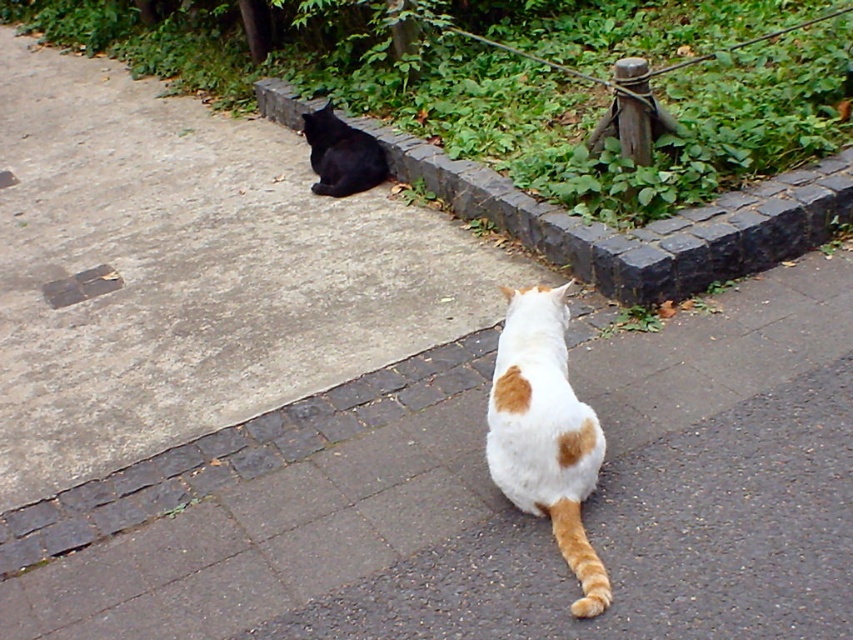
Can you confirm if gray stone curb at upper center is positioned to the right of white and orange fur cat at center?

Indeed, gray stone curb at upper center is positioned on the right side of white and orange fur cat at center.

Does gray stone curb at upper center lie in front of white and orange fur cat at center?

No.

The width and height of the screenshot is (853, 640). I want to click on gray stone curb at upper center, so click(x=641, y=227).

Which is behind, point (663, 285) or point (347, 140)?

Point (347, 140)

Can you confirm if gray stone curb at upper center is positioned to the right of shiny black cat at upper left?

Indeed, gray stone curb at upper center is positioned on the right side of shiny black cat at upper left.

Which is in front, point (840, 195) or point (328, 195)?

Positioned in front is point (840, 195).

I want to click on gray stone curb at upper center, so click(x=641, y=227).

Does point (527, 324) come closer to viewer compared to point (338, 157)?

That is True.

Which is more to the right, white and orange fur cat at center or shiny black cat at upper left?

Positioned to the right is white and orange fur cat at center.

At what (x,y) coordinates should I click in order to perform the action: click on white and orange fur cat at center. Please return your answer as a coordinate pair (x, y). This screenshot has width=853, height=640. Looking at the image, I should click on (544, 433).